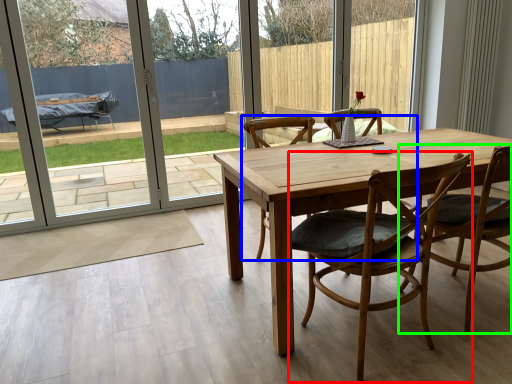
Question: Estimate the real-world distances between objects in this image. Which object is closer to chair (highlighted by a red box), chair (highlighted by a blue box) or chair (highlighted by a green box)?

Choices:
 (A) chair
 (B) chair

Answer: (B)